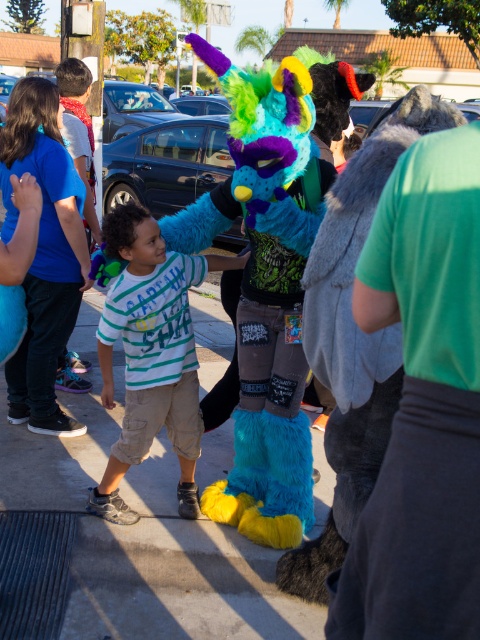
Question: Which point is farther from the camera taking this photo?

Choices:
 (A) (72, 380)
 (B) (168, 314)
 (C) (6, 236)

Answer: (A)

Question: Is smooth concrete pavement at center wider than striped cotton shirt at center?

Choices:
 (A) no
 (B) yes

Answer: (B)

Question: Which point is farther to the camera?

Choices:
 (A) (41, 150)
 (B) (144, 390)
 (C) (444, 499)
 (D) (207, 588)

Answer: (A)

Question: Can you confirm if blue cotton shirt at upper left is bigger than blue cotton shirt at left?

Choices:
 (A) no
 (B) yes

Answer: (B)

Question: Does fuzzy gray vest at right lie behind fluffy blue and green monster at center?

Choices:
 (A) no
 (B) yes

Answer: (A)

Question: Estimate the real-world distances between objects in this image. Which object is farther from the blue cotton shirt at upper left?

Choices:
 (A) striped cotton shirt at center
 (B) blue cotton shirt at left
 (C) fuzzy gray vest at right

Answer: (C)